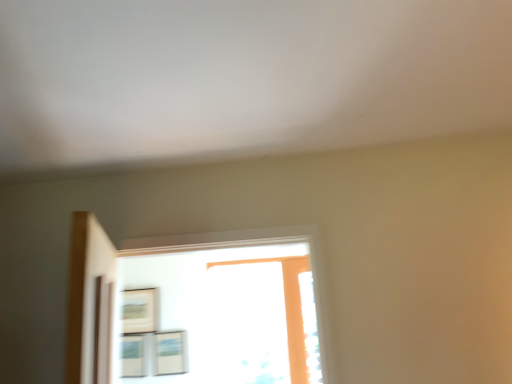
Question: Considering the relative sizes of matte wooden picture frame at center, which ranks as the first picture frame in right-to-left order, and matte white picture frame at lower left, arranged as the 2th picture frame when viewed from the right, in the image provided, is matte wooden picture frame at center, which ranks as the first picture frame in right-to-left order, taller than matte white picture frame at lower left, arranged as the 2th picture frame when viewed from the right,?

Choices:
 (A) yes
 (B) no

Answer: (A)

Question: Is matte wooden picture frame at center, the third picture frame from the left, far away from matte white picture frame at lower left, marked as the second picture frame in a left-to-right arrangement?

Choices:
 (A) yes
 (B) no

Answer: (B)

Question: Is matte white picture frame at lower left, marked as the second picture frame in a left-to-right arrangement, at the back of matte wooden picture frame at center, the third picture frame from the left?

Choices:
 (A) no
 (B) yes

Answer: (A)

Question: Is matte wooden picture frame at center, which ranks as the first picture frame in right-to-left order, further to camera compared to matte white picture frame at lower left, marked as the second picture frame in a left-to-right arrangement?

Choices:
 (A) yes
 (B) no

Answer: (B)

Question: Does matte wooden picture frame at center, which ranks as the first picture frame in right-to-left order, contain matte white picture frame at lower left, arranged as the 2th picture frame when viewed from the right?

Choices:
 (A) no
 (B) yes

Answer: (A)

Question: From their relative heights in the image, would you say matte wooden picture frame at center, the third picture frame from the left, is taller or shorter than matte black picture frame at upper left, the first picture frame when ordered from left to right?

Choices:
 (A) tall
 (B) short

Answer: (B)

Question: Is matte wooden picture frame at center, the third picture frame from the left, wider or thinner than matte black picture frame at upper left, the first picture frame when ordered from left to right?

Choices:
 (A) thin
 (B) wide

Answer: (A)

Question: Based on their sizes in the image, would you say matte wooden picture frame at center, which ranks as the first picture frame in right-to-left order, is bigger or smaller than matte black picture frame at upper left, arranged as the third picture frame when viewed from the right?

Choices:
 (A) small
 (B) big

Answer: (A)

Question: From the image's perspective, is matte wooden picture frame at center, the third picture frame from the left, above or below matte black picture frame at upper left, the first picture frame when ordered from left to right?

Choices:
 (A) below
 (B) above

Answer: (A)

Question: Considering the positions of matte black picture frame at upper left, the first picture frame when ordered from left to right, and matte wooden picture frame at center, the third picture frame from the left, in the image, is matte black picture frame at upper left, the first picture frame when ordered from left to right, taller or shorter than matte wooden picture frame at center, the third picture frame from the left,?

Choices:
 (A) short
 (B) tall

Answer: (B)

Question: From the image's perspective, relative to matte wooden picture frame at center, which ranks as the first picture frame in right-to-left order, is matte black picture frame at upper left, arranged as the third picture frame when viewed from the right, above or below?

Choices:
 (A) above
 (B) below

Answer: (A)

Question: Is matte black picture frame at upper left, arranged as the third picture frame when viewed from the right, in front of or behind matte wooden picture frame at center, which ranks as the first picture frame in right-to-left order, in the image?

Choices:
 (A) front
 (B) behind

Answer: (B)

Question: Based on their positions, is matte black picture frame at upper left, arranged as the third picture frame when viewed from the right, located to the left or right of matte wooden picture frame at center, the third picture frame from the left?

Choices:
 (A) left
 (B) right

Answer: (A)

Question: From a real-world perspective, is matte white picture frame at lower left, arranged as the 2th picture frame when viewed from the right, positioned above or below matte black picture frame at upper left, arranged as the third picture frame when viewed from the right?

Choices:
 (A) below
 (B) above

Answer: (A)

Question: From their relative heights in the image, would you say matte white picture frame at lower left, arranged as the 2th picture frame when viewed from the right, is taller or shorter than matte black picture frame at upper left, arranged as the third picture frame when viewed from the right?

Choices:
 (A) tall
 (B) short

Answer: (B)